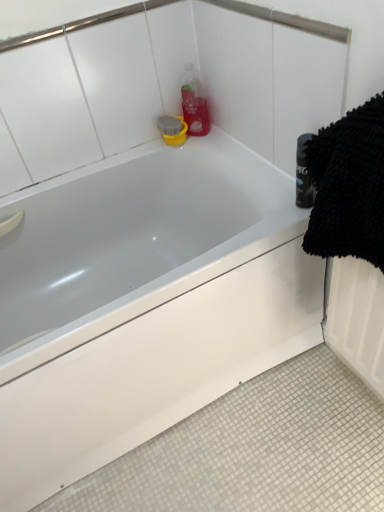
Question: Is black microfiber towel at right to the left of white glossy bathtub at upper center from the viewer's perspective?

Choices:
 (A) no
 (B) yes

Answer: (A)

Question: Can you confirm if black microfiber towel at right is taller than white glossy bathtub at upper center?

Choices:
 (A) no
 (B) yes

Answer: (B)

Question: From the image's perspective, does black microfiber towel at right appear higher than white glossy bathtub at upper center?

Choices:
 (A) yes
 (B) no

Answer: (A)

Question: Would you say black microfiber towel at right contains white glossy bathtub at upper center?

Choices:
 (A) yes
 (B) no

Answer: (B)

Question: From the image's perspective, is black microfiber towel at right beneath white glossy bathtub at upper center?

Choices:
 (A) yes
 (B) no

Answer: (B)

Question: Would you say black microfiber towel at right is to the left or to the right of translucent plastic bottle at upper center in the picture?

Choices:
 (A) right
 (B) left

Answer: (A)

Question: From the image's perspective, is black microfiber towel at right above or below translucent plastic bottle at upper center?

Choices:
 (A) above
 (B) below

Answer: (B)

Question: Considering the positions of black microfiber towel at right and translucent plastic bottle at upper center in the image, is black microfiber towel at right taller or shorter than translucent plastic bottle at upper center?

Choices:
 (A) tall
 (B) short

Answer: (A)

Question: Is black microfiber towel at right situated inside translucent plastic bottle at upper center or outside?

Choices:
 (A) inside
 (B) outside

Answer: (B)

Question: From their relative heights in the image, would you say black microfiber towel at right is taller or shorter than white glossy bathtub at upper center?

Choices:
 (A) tall
 (B) short

Answer: (A)

Question: Is black microfiber towel at right to the left or to the right of white glossy bathtub at upper center in the image?

Choices:
 (A) right
 (B) left

Answer: (A)

Question: In the image, is black microfiber towel at right positioned in front of or behind white glossy bathtub at upper center?

Choices:
 (A) behind
 (B) front

Answer: (B)

Question: From a real-world perspective, is black microfiber towel at right above or below white glossy bathtub at upper center?

Choices:
 (A) above
 (B) below

Answer: (A)

Question: Relative to black microfiber towel at right, is translucent plastic bottle at upper center in front or behind?

Choices:
 (A) behind
 (B) front

Answer: (A)

Question: From their relative heights in the image, would you say translucent plastic bottle at upper center is taller or shorter than black microfiber towel at right?

Choices:
 (A) tall
 (B) short

Answer: (B)